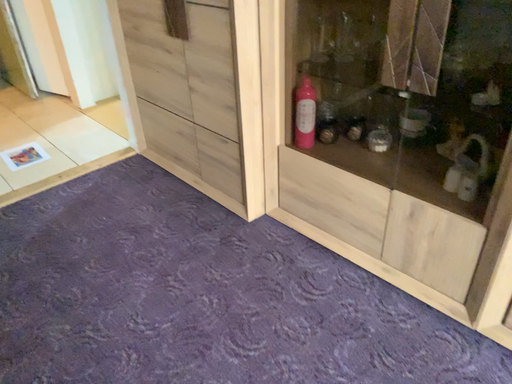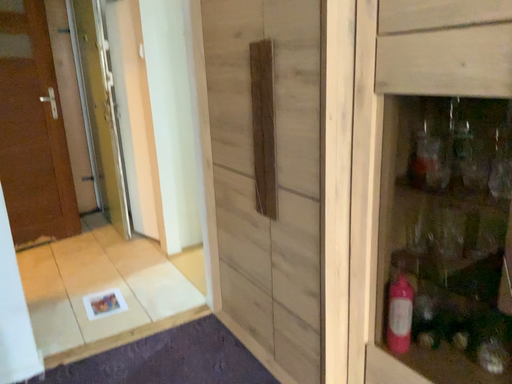
Question: Which way did the camera rotate in the video?

Choices:
 (A) rotated upward
 (B) rotated downward

Answer: (A)